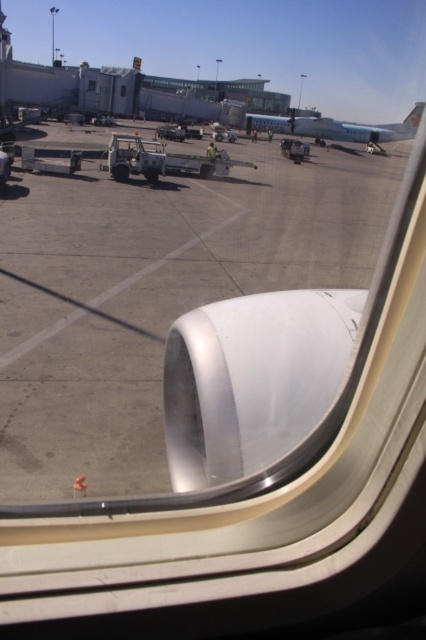
Can you confirm if white matte airplane at upper center is shorter than transparent glass window at center?

In fact, white matte airplane at upper center may be taller than transparent glass window at center.

Locate an element on the screen. The image size is (426, 640). white matte airplane at upper center is located at coordinates (336, 128).

Identify the location of white matte airplane at upper center. This screenshot has width=426, height=640. pyautogui.click(x=336, y=128).